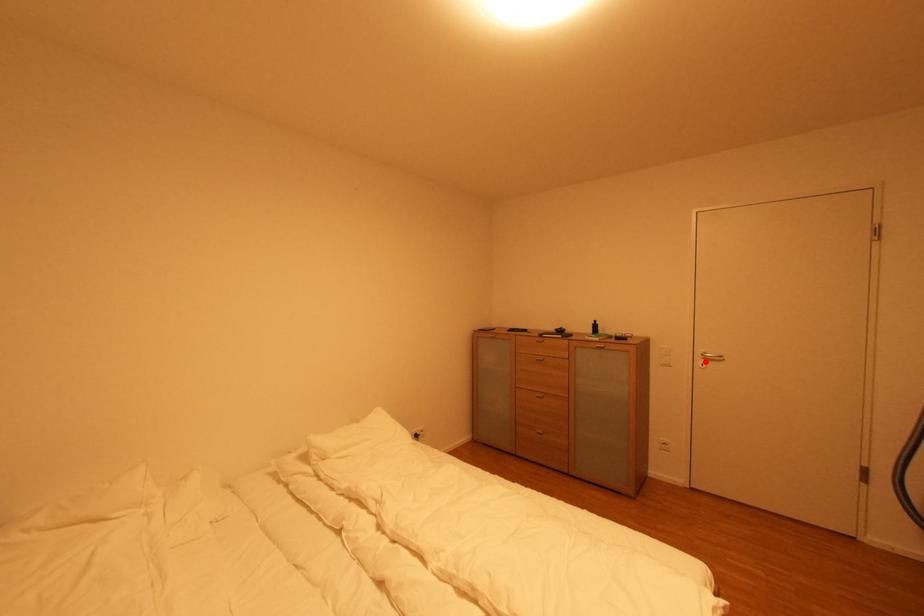
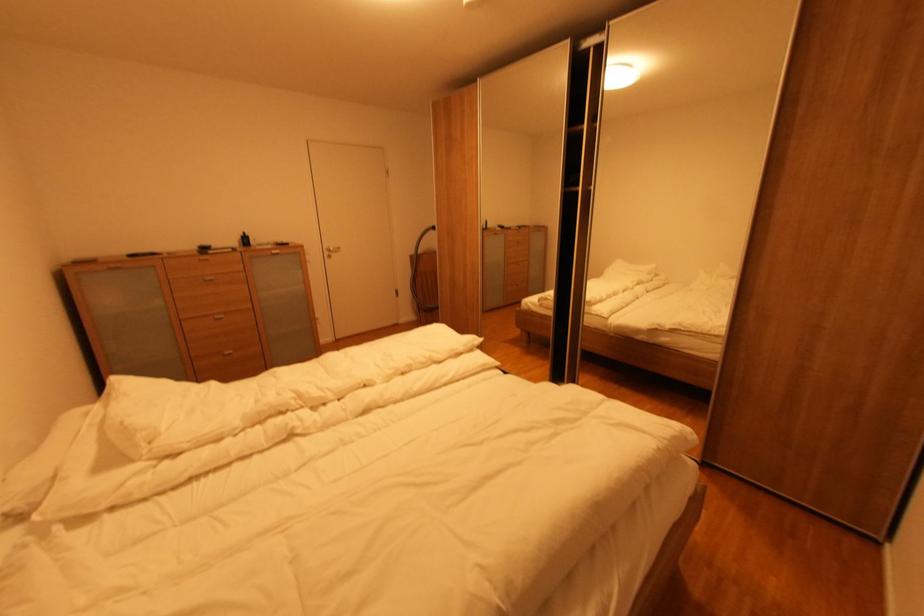
The point at the highlighted location is marked in the first image. Where is the corresponding point in the second image?

(333, 254)